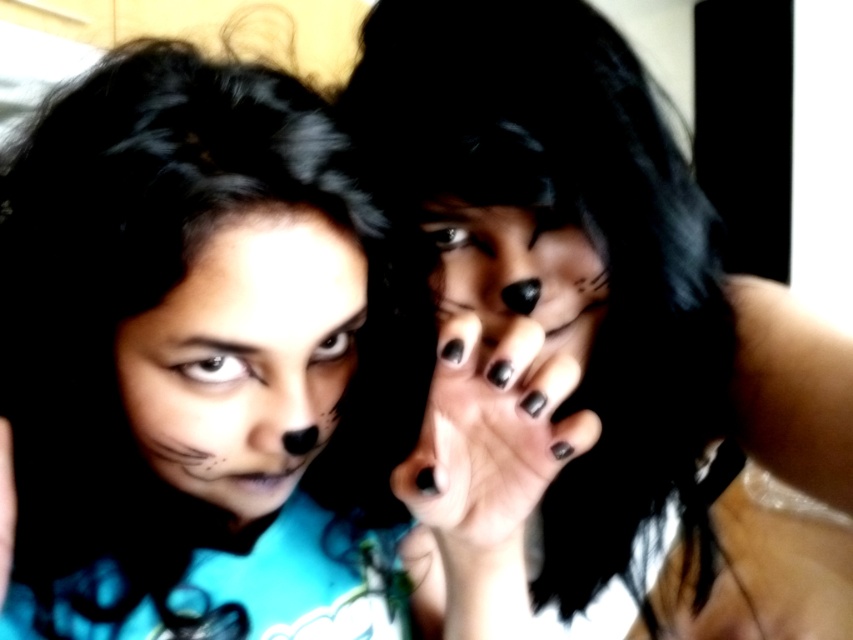
Question: Which point appears closest to the camera in this image?

Choices:
 (A) (561, 266)
 (B) (700, 605)

Answer: (A)

Question: Which object is positioned farthest from the matte black face paint at center?

Choices:
 (A) matte black nails at center
 (B) black matte nails at center
 (C) matte black hand at center

Answer: (A)

Question: Can you confirm if matte black face at center is positioned below matte black nails at center?

Choices:
 (A) yes
 (B) no

Answer: (A)

Question: Can you confirm if matte black hand at center is bigger than matte black face at center?

Choices:
 (A) yes
 (B) no

Answer: (A)

Question: Can you confirm if matte black face paint at center is positioned below black matte nails at center?

Choices:
 (A) no
 (B) yes

Answer: (A)

Question: Which object is the closest to the matte black nails at center?

Choices:
 (A) matte black face paint at center
 (B) matte black face at center

Answer: (B)